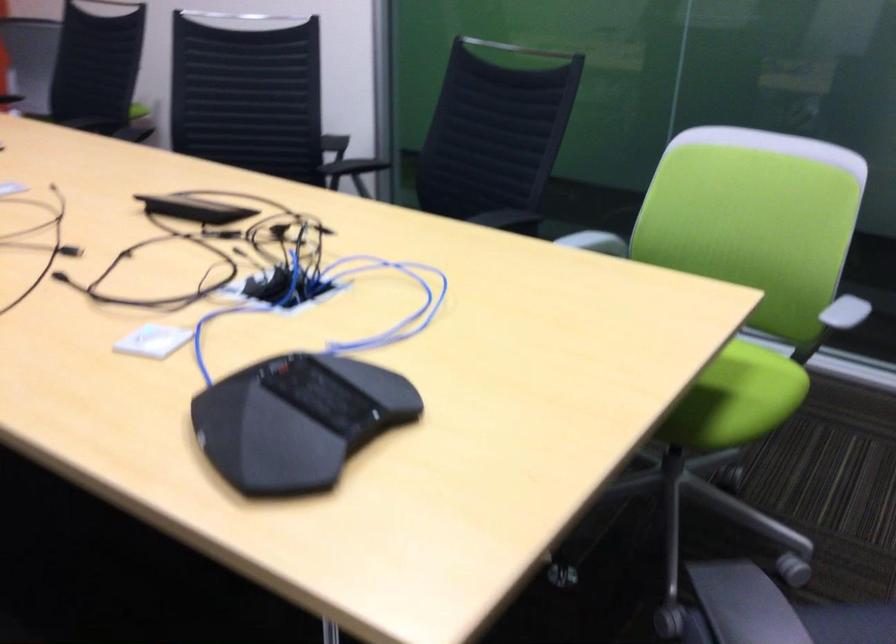
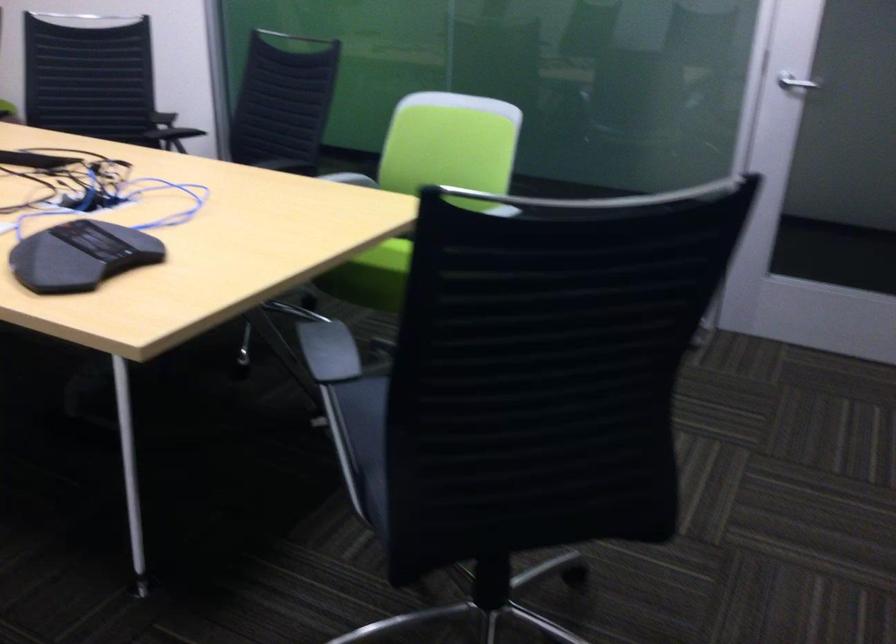
Question: The camera is either moving clockwise (left) or counter-clockwise (right) around the object. The first image is from the beginning of the video and the second image is from the end. Is the camera moving left or right when shooting the video?

Choices:
 (A) Left
 (B) Right

Answer: (A)